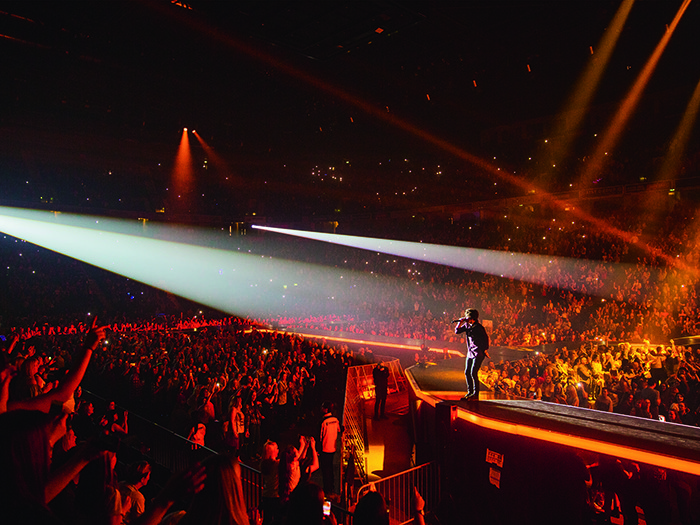
What are the coordinates of `corners` in the screenshot? It's located at (693, 505), (15, 507), (13, 30), (685, 13).